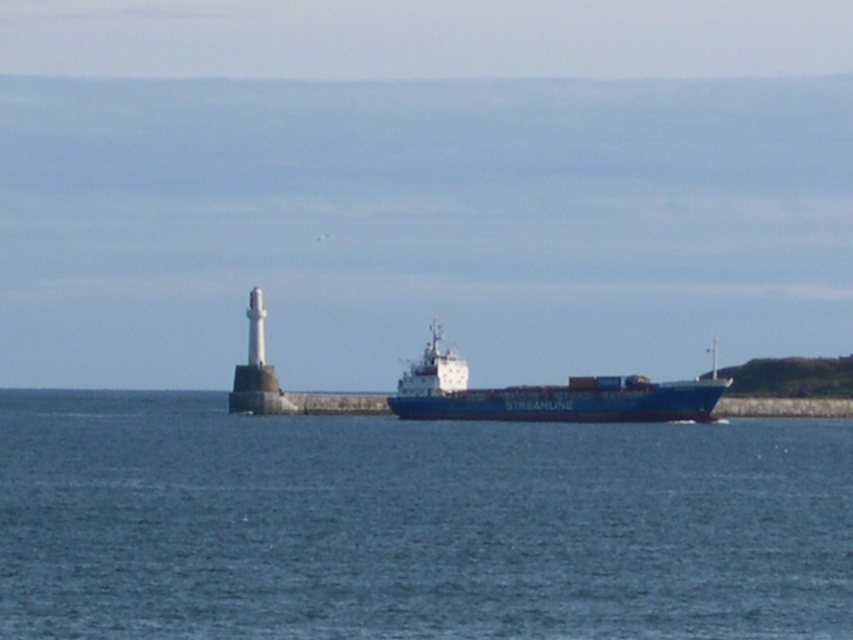
Question: Can you confirm if blue water at center is positioned to the left of blue matte container ship at center?

Choices:
 (A) no
 (B) yes

Answer: (B)

Question: Does blue water at center appear on the right side of blue matte container ship at center?

Choices:
 (A) yes
 (B) no

Answer: (B)

Question: Which object is farther from the camera taking this photo?

Choices:
 (A) blue matte container ship at center
 (B) blue water at center

Answer: (A)

Question: Which of the following is the farthest from the observer?

Choices:
 (A) tap(567, 385)
 (B) tap(242, 422)

Answer: (B)

Question: Which point is farther to the camera?

Choices:
 (A) blue water at center
 (B) blue matte container ship at center

Answer: (B)

Question: Is blue water at center further to the viewer compared to blue matte container ship at center?

Choices:
 (A) yes
 (B) no

Answer: (B)